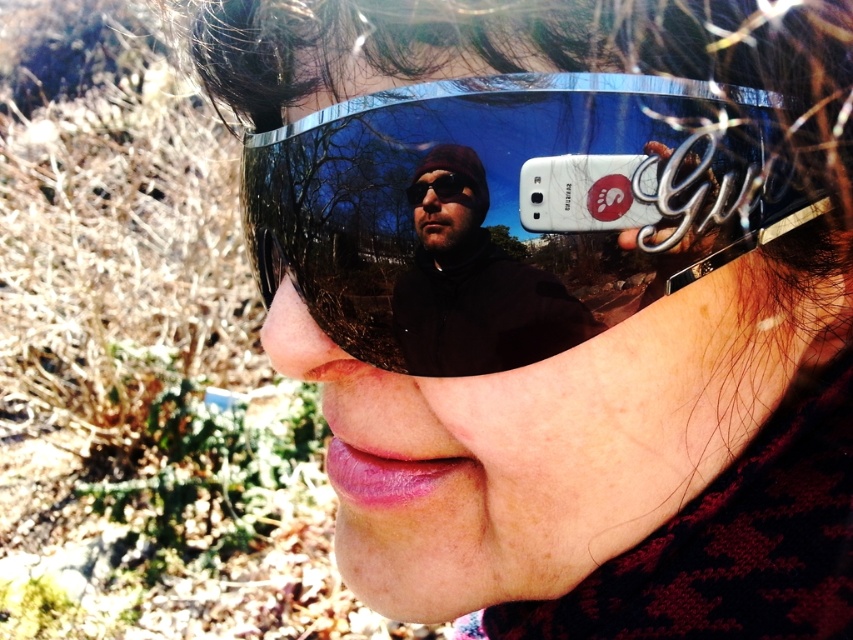
Consider the image. Is shiny metallic goggles at center wider than matte black jacket at center?

Correct, the width of shiny metallic goggles at center exceeds that of matte black jacket at center.

Is shiny metallic goggles at center to the left of matte black jacket at center from the viewer's perspective?

Incorrect, shiny metallic goggles at center is not on the left side of matte black jacket at center.

Image resolution: width=853 pixels, height=640 pixels. What do you see at coordinates (514, 208) in the screenshot?
I see `shiny metallic goggles at center` at bounding box center [514, 208].

Locate an element on the screen. The image size is (853, 640). shiny metallic goggles at center is located at coordinates (514, 208).